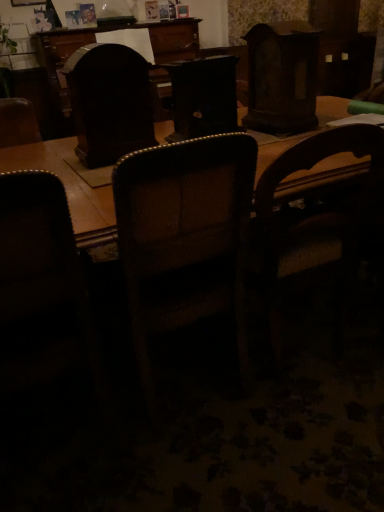
Question: Choose the correct answer: Is dark brown leather chair at left, the third chair from the right, inside dark wood swivel chair at center or outside it?

Choices:
 (A) outside
 (B) inside

Answer: (A)

Question: From a real-world perspective, is dark brown leather chair at left, the first chair when ordered from left to right, physically located above or below dark wood swivel chair at center?

Choices:
 (A) below
 (B) above

Answer: (A)

Question: Which is nearer to the brown leather chair at center, arranged as the 2th chair when viewed from the right?

Choices:
 (A) dark wood swivel chair at center
 (B) wooden chair at center, which appears as the 1th chair when viewed from the right
 (C) dark brown leather chair at left, the third chair from the right

Answer: (B)

Question: Which of these objects is positioned closest to the wooden chair at center, which is counted as the 3th chair, starting from the left?

Choices:
 (A) dark brown leather chair at left, the first chair when ordered from left to right
 (B) brown leather chair at center, arranged as the 2th chair when viewed from the right
 (C) dark wood swivel chair at center

Answer: (B)